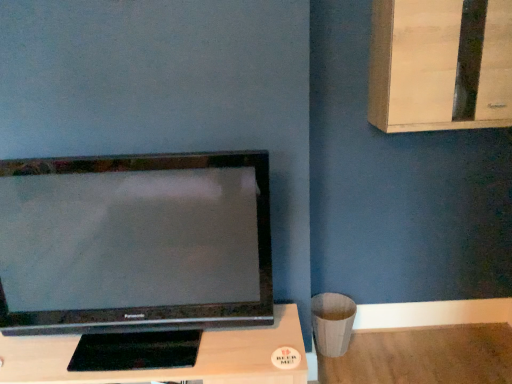
Question: Can you confirm if satin black television at left is positioned to the left of light wood dresser at upper right?

Choices:
 (A) yes
 (B) no

Answer: (A)

Question: Can you confirm if satin black television at left is taller than light wood dresser at upper right?

Choices:
 (A) yes
 (B) no

Answer: (A)

Question: Considering the relative sizes of satin black television at left and light wood dresser at upper right in the image provided, is satin black television at left thinner than light wood dresser at upper right?

Choices:
 (A) no
 (B) yes

Answer: (B)

Question: From the image's perspective, does satin black television at left appear higher than light wood dresser at upper right?

Choices:
 (A) no
 (B) yes

Answer: (A)

Question: Could you tell me if satin black television at left is turned towards light wood dresser at upper right?

Choices:
 (A) yes
 (B) no

Answer: (B)

Question: From a real-world perspective, is light wood dresser at upper right physically located above or below satin black television at left?

Choices:
 (A) below
 (B) above

Answer: (B)

Question: Based on their sizes in the image, would you say light wood dresser at upper right is bigger or smaller than satin black television at left?

Choices:
 (A) big
 (B) small

Answer: (B)

Question: Would you say light wood dresser at upper right is inside or outside satin black television at left?

Choices:
 (A) outside
 (B) inside

Answer: (A)

Question: Based on their positions, is light wood dresser at upper right located to the left or right of satin black television at left?

Choices:
 (A) left
 (B) right

Answer: (B)

Question: Is satin black television at left inside the boundaries of light wood dresser at upper right, or outside?

Choices:
 (A) inside
 (B) outside

Answer: (B)

Question: In terms of size, does satin black television at left appear bigger or smaller than light wood dresser at upper right?

Choices:
 (A) big
 (B) small

Answer: (A)

Question: Based on their positions, is satin black television at left located to the left or right of light wood dresser at upper right?

Choices:
 (A) right
 (B) left

Answer: (B)

Question: In terms of width, does satin black television at left look wider or thinner when compared to light wood dresser at upper right?

Choices:
 (A) wide
 (B) thin

Answer: (B)

Question: Is black matte tv at center inside or outside of satin black television at left?

Choices:
 (A) outside
 (B) inside

Answer: (A)

Question: Is black matte tv at center bigger or smaller than satin black television at left?

Choices:
 (A) small
 (B) big

Answer: (B)